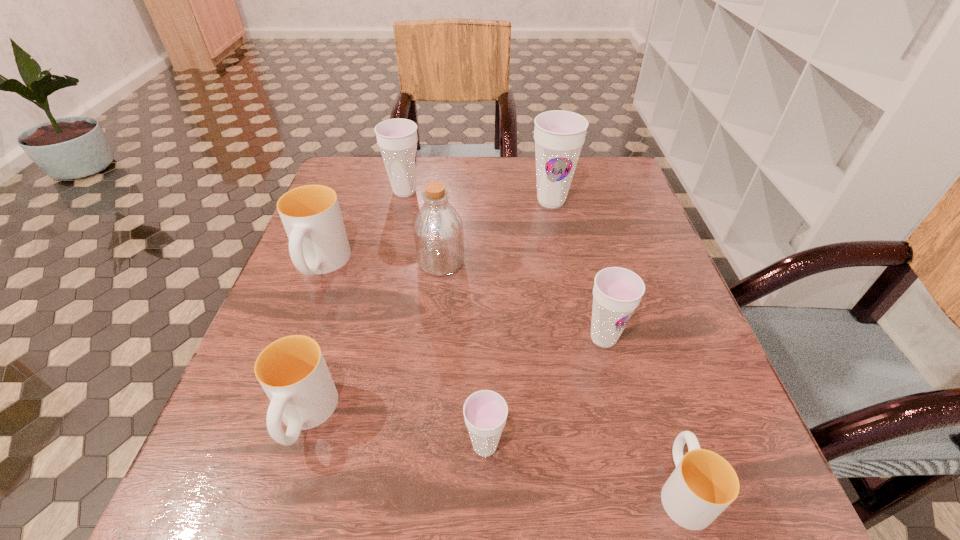
At what (x,y) coordinates should I click in order to perform the action: click on the tallest cup. Please return your answer as a coordinate pair (x, y). This screenshot has height=540, width=960. Looking at the image, I should click on (559, 135).

I want to click on bottle, so click(438, 229).

This screenshot has width=960, height=540. What are the coordinates of `the leftmost purple cup` in the screenshot? It's located at (397, 138).

Where is `the second tallest cup`? The image size is (960, 540). the second tallest cup is located at coordinates (397, 138).

Identify the location of the biggest yellow cup. (318, 244).

I want to click on the farthest yellow cup, so click(318, 244).

Image resolution: width=960 pixels, height=540 pixels. I want to click on the fourth nearest object, so click(x=617, y=291).

The width and height of the screenshot is (960, 540). I want to click on the third farthest purple cup, so click(x=617, y=291).

Locate an element on the screen. The width and height of the screenshot is (960, 540). the second smallest yellow cup is located at coordinates (292, 371).

The width and height of the screenshot is (960, 540). In order to click on the fourth cup from left to right in this screenshot , I will do `click(485, 412)`.